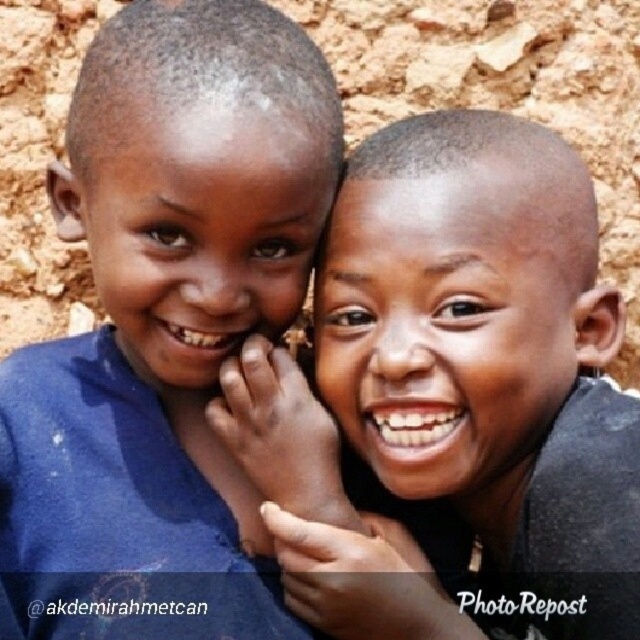
Question: Which point appears closest to the camera in this image?

Choices:
 (A) (627, 556)
 (B) (225, 621)
 (C) (424, 419)

Answer: (A)

Question: Estimate the real-world distances between objects in this image. Which object is closer to the dark skin/smooth face at center?

Choices:
 (A) matte skin face at center
 (B) blue fabric shirt at left
 (C) smooth skin face at center

Answer: (C)

Question: Does dark skin/smooth face at center have a smaller size compared to matte skin face at center?

Choices:
 (A) yes
 (B) no

Answer: (B)

Question: In this image, where is dark skin/smooth face at center located relative to matte skin face at center?

Choices:
 (A) above
 (B) below

Answer: (B)

Question: Which point is farther from the camera taking this photo?

Choices:
 (A) (560, 182)
 (B) (164, 280)

Answer: (A)

Question: Where is blue fabric shirt at left located in relation to matte skin face at center in the image?

Choices:
 (A) right
 (B) left

Answer: (A)